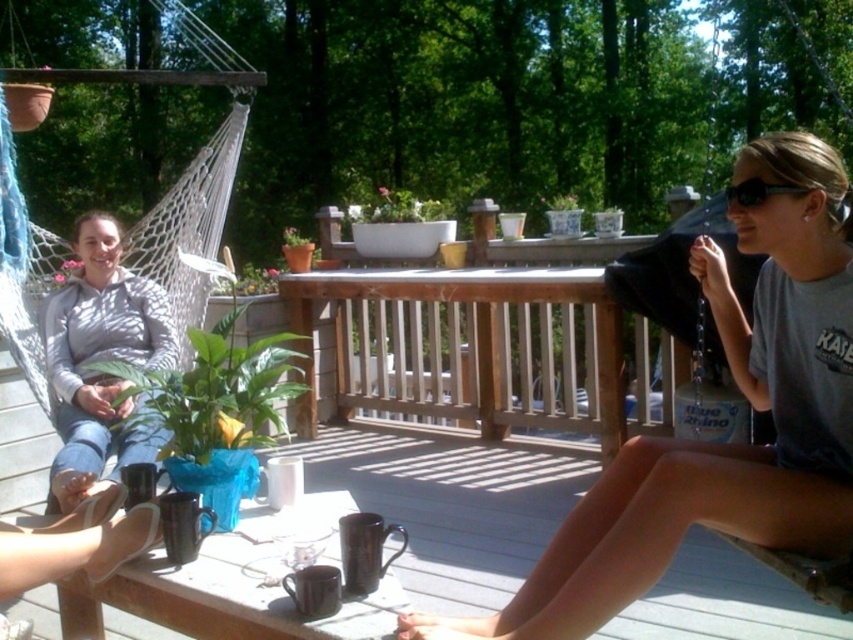
Is matte black bag at right shorter than black plastic sunglasses at upper right?

Incorrect, matte black bag at right's height does not fall short of black plastic sunglasses at upper right's.

Does matte black bag at right have a smaller size compared to black plastic sunglasses at upper right?

Actually, matte black bag at right might be larger than black plastic sunglasses at upper right.

I want to click on matte black bag at right, so click(x=721, y=444).

Locate an element on the screen. This screenshot has height=640, width=853. matte black bag at right is located at coordinates click(721, 444).

Can you confirm if light gray hoodie at left is bigger than black fabric swing at upper right?

Actually, light gray hoodie at left might be smaller than black fabric swing at upper right.

Is light gray hoodie at left closer to camera compared to black fabric swing at upper right?

No.

Is point (51, 296) in front of point (712, 52)?

Yes, point (51, 296) is closer to viewer.

Locate an element on the screen. The width and height of the screenshot is (853, 640). light gray hoodie at left is located at coordinates (x=102, y=358).

Is matte black bag at right thinner than light gray hoodie at left?

No.

How much distance is there between matte black bag at right and light gray hoodie at left?

matte black bag at right is 1.46 meters away from light gray hoodie at left.

Describe the element at coordinates (721, 444) in the screenshot. I see `matte black bag at right` at that location.

Where is `matte black bag at right`? matte black bag at right is located at coordinates point(721,444).